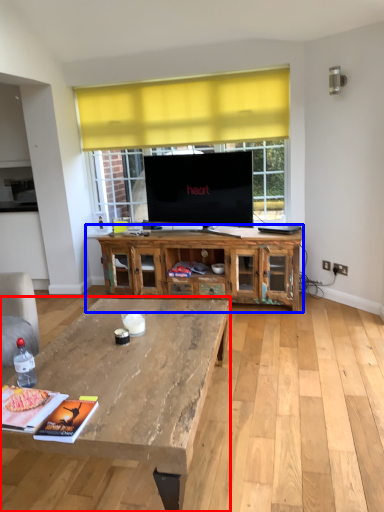
Question: Which object is closer to the camera taking this photo, coffee table (highlighted by a red box) or cabinetry (highlighted by a blue box)?

Choices:
 (A) coffee table
 (B) cabinetry

Answer: (A)